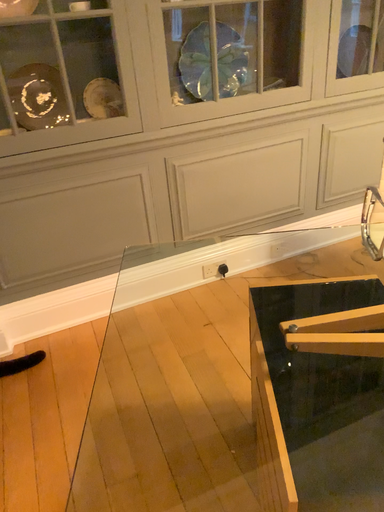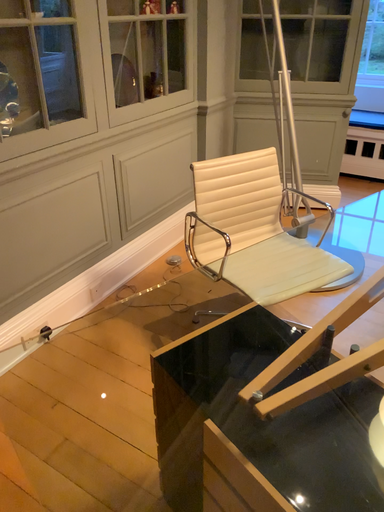
Question: Which way did the camera rotate in the video?

Choices:
 (A) rotated left
 (B) rotated right

Answer: (B)